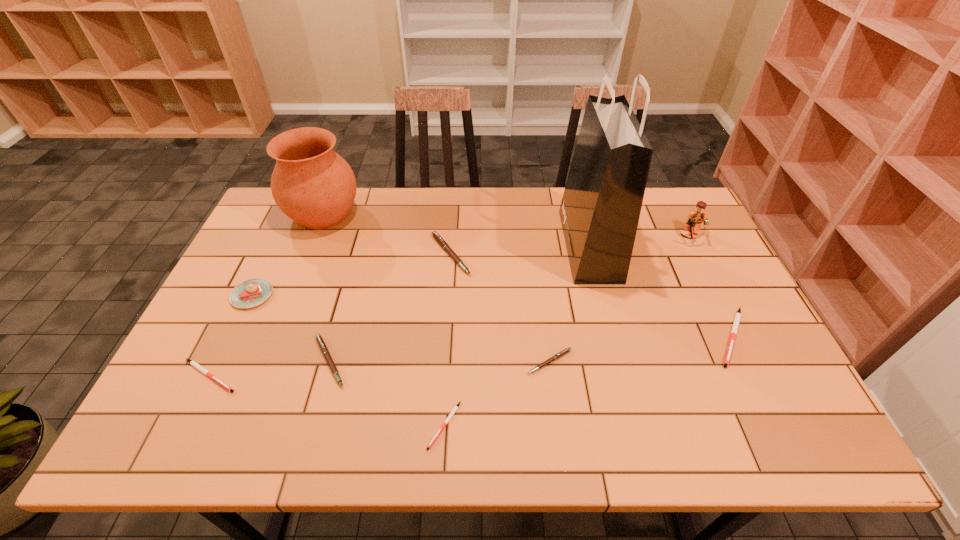
The image size is (960, 540). What are the coordinates of `Lego positioned at the far edge` in the screenshot? It's located at (694, 219).

At what (x,y) coordinates should I click in order to perform the action: click on object present at the near edge. Please return your answer as a coordinate pair (x, y). This screenshot has width=960, height=540. Looking at the image, I should click on (451, 414).

Find the location of a particular element. The image size is (960, 540). pottery that is at the left edge is located at coordinates (313, 185).

Where is `pastry present at the left edge`? pastry present at the left edge is located at coordinates (252, 292).

You are a GUI agent. You are given a task and a screenshot of the screen. Output one action in this format:
    pyautogui.click(x=<x>, y=<y>)
    Task: Click on the pen located in the left edge section of the desktop
    The width and height of the screenshot is (960, 540).
    Given the screenshot: What is the action you would take?
    pyautogui.click(x=193, y=363)

Find the location of a particular element. This screenshot has width=960, height=540. Lego that is at the right edge is located at coordinates (694, 219).

Identify the location of pen that is at the right edge. The height and width of the screenshot is (540, 960). (738, 315).

The width and height of the screenshot is (960, 540). In order to click on object situated at the far left corner in this screenshot , I will do `click(313, 185)`.

The width and height of the screenshot is (960, 540). I want to click on object that is positioned at the far right corner, so click(x=694, y=219).

Identify the location of vacant space at the far edge of the desktop. (453, 198).